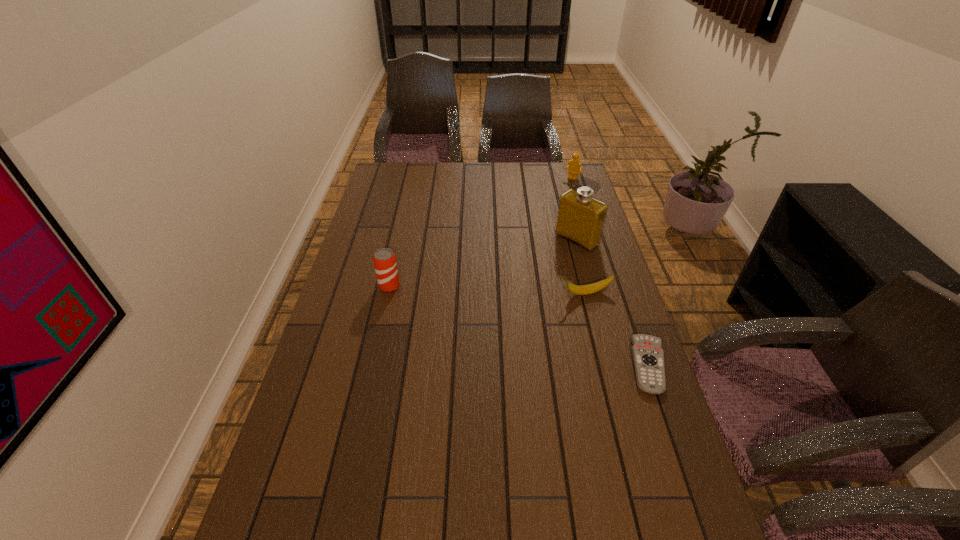
The width and height of the screenshot is (960, 540). In order to click on remote control present at the right edge in this screenshot , I will do `click(648, 357)`.

Where is `banana that is at the right edge`? The width and height of the screenshot is (960, 540). banana that is at the right edge is located at coordinates (592, 288).

Find the location of a particular element. This screenshot has width=960, height=540. perfume present at the right edge is located at coordinates (581, 218).

Where is `Lego that is at the right edge`? This screenshot has width=960, height=540. Lego that is at the right edge is located at coordinates (575, 167).

Find the location of a particular element. The width and height of the screenshot is (960, 540). object that is at the far right corner is located at coordinates (575, 167).

You are a GUI agent. You are given a task and a screenshot of the screen. Output one action in this format:
    pyautogui.click(x=<x>, y=<y>)
    Task: Click on the vacant space at the near edge
    The height and width of the screenshot is (540, 960).
    Given the screenshot: What is the action you would take?
    pyautogui.click(x=582, y=539)

I want to click on vacant area at the left edge, so click(392, 230).

Image resolution: width=960 pixels, height=540 pixels. In the image, there is a desktop. What are the coordinates of `vacant space at the right edge` in the screenshot? It's located at (584, 341).

Locate an element on the screen. vacant space at the near left corner is located at coordinates (286, 505).

In order to click on free space between the tallest object and the leftmost object in this screenshot , I will do `click(483, 263)`.